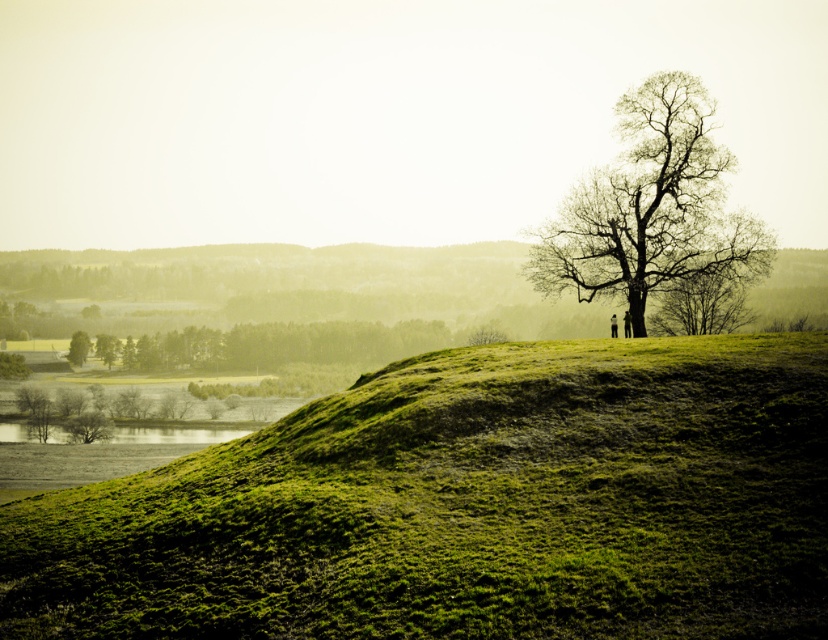
Does green mossy hillside at upper center appear over green mossy hillside at lower left?

No.

Is green mossy hillside at upper center taller than green mossy hillside at lower left?

Indeed, green mossy hillside at upper center has a greater height compared to green mossy hillside at lower left.

Describe the element at coordinates (467, 506) in the screenshot. I see `green mossy hillside at upper center` at that location.

You are a GUI agent. You are given a task and a screenshot of the screen. Output one action in this format:
    pyautogui.click(x=<x>, y=<y>)
    Task: Click on the green mossy hillside at upper center
    
    Given the screenshot: What is the action you would take?
    pyautogui.click(x=467, y=506)

Who is lower down, green mossy bush at lower left or green mossy hillside at lower left?

green mossy bush at lower left is lower down.

Locate an element on the screen. The width and height of the screenshot is (828, 640). green mossy bush at lower left is located at coordinates (12, 365).

Which is behind, point (2, 364) or point (75, 337)?

Point (75, 337)

You are a GUI agent. You are given a task and a screenshot of the screen. Output one action in this format:
    pyautogui.click(x=<x>, y=<y>)
    Task: Click on the green mossy bush at lower left
    
    Given the screenshot: What is the action you would take?
    pyautogui.click(x=12, y=365)

Is bare wood tree at upper right positioned before green mossy hillside at lower left?

Yes.

Is the position of bare wood tree at upper right more distant than that of green mossy hillside at lower left?

No, bare wood tree at upper right is in front of green mossy hillside at lower left.

Measure the distance between point (672, 221) and camera.

Point (672, 221) and camera are 208.52 feet apart from each other.

Identify the location of bare wood tree at upper right. (651, 208).